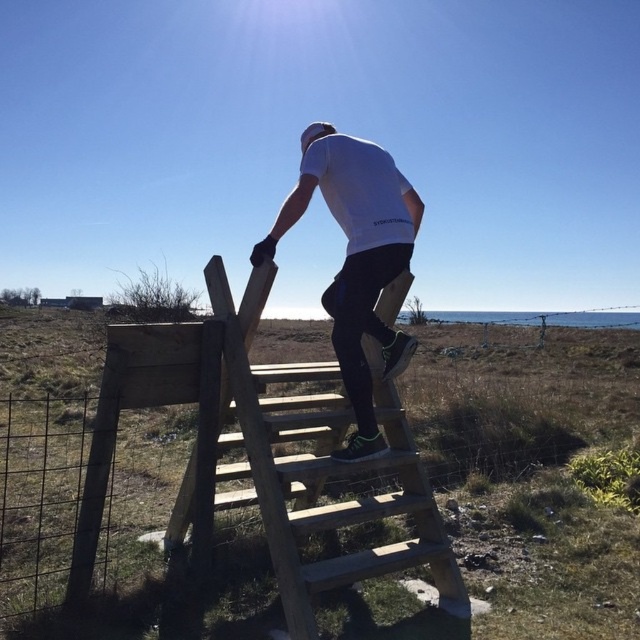
Question: Is wooden stairs at center thinner than white matte shirt at upper center?

Choices:
 (A) yes
 (B) no

Answer: (B)

Question: Among these objects, which one is farthest from the camera?

Choices:
 (A) wooden stairs at center
 (B) white matte shirt at upper center

Answer: (B)

Question: Is wooden stairs at center to the left of white matte shirt at upper center from the viewer's perspective?

Choices:
 (A) no
 (B) yes

Answer: (B)

Question: Which of the following is the farthest from the observer?

Choices:
 (A) (259, 316)
 (B) (417, 208)

Answer: (B)

Question: Does wooden stairs at center have a lesser width compared to white matte shirt at upper center?

Choices:
 (A) yes
 (B) no

Answer: (B)